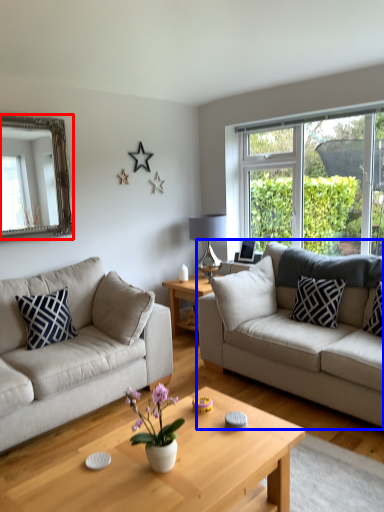
Question: Which object is closer to the camera taking this photo, mirror (highlighted by a red box) or studio couch (highlighted by a blue box)?

Choices:
 (A) mirror
 (B) studio couch

Answer: (B)